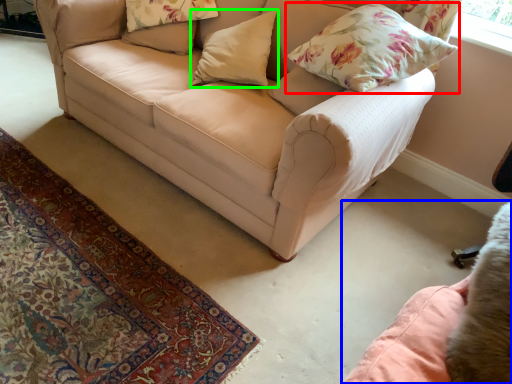
Question: Estimate the real-world distances between objects in this image. Which object is closer to pillow (highlighted by a red box), swivel chair (highlighted by a blue box) or pillow (highlighted by a green box)?

Choices:
 (A) swivel chair
 (B) pillow

Answer: (B)